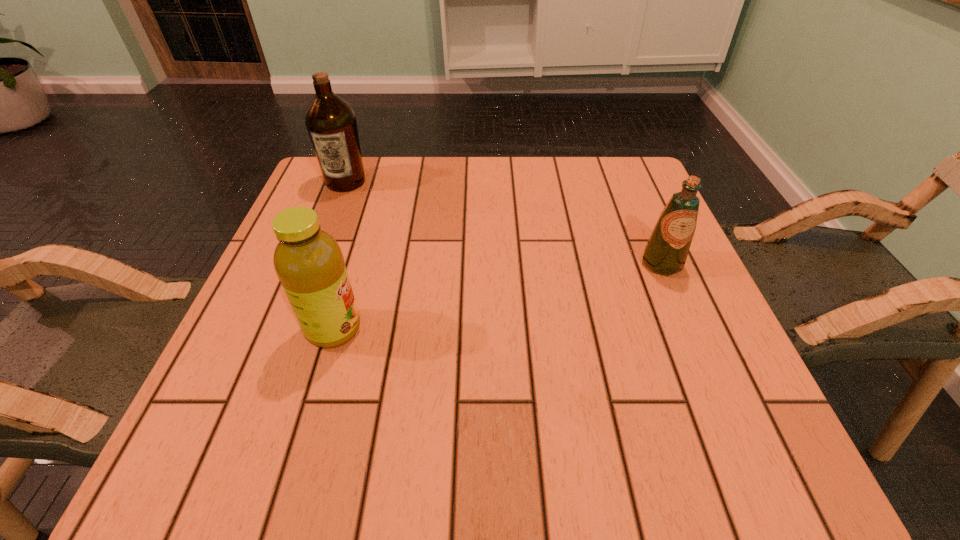
Where is `vacant space that satisfies the following two spatial constraints: 1. on the front-facing side of the shorter olive oil; 2. on the front label of the fruit juice`? The width and height of the screenshot is (960, 540). vacant space that satisfies the following two spatial constraints: 1. on the front-facing side of the shorter olive oil; 2. on the front label of the fruit juice is located at coordinates (689, 329).

Identify the location of vacant space that satisfies the following two spatial constraints: 1. on the front-facing side of the right olive oil; 2. on the front label of the nearest object. The image size is (960, 540). (689, 329).